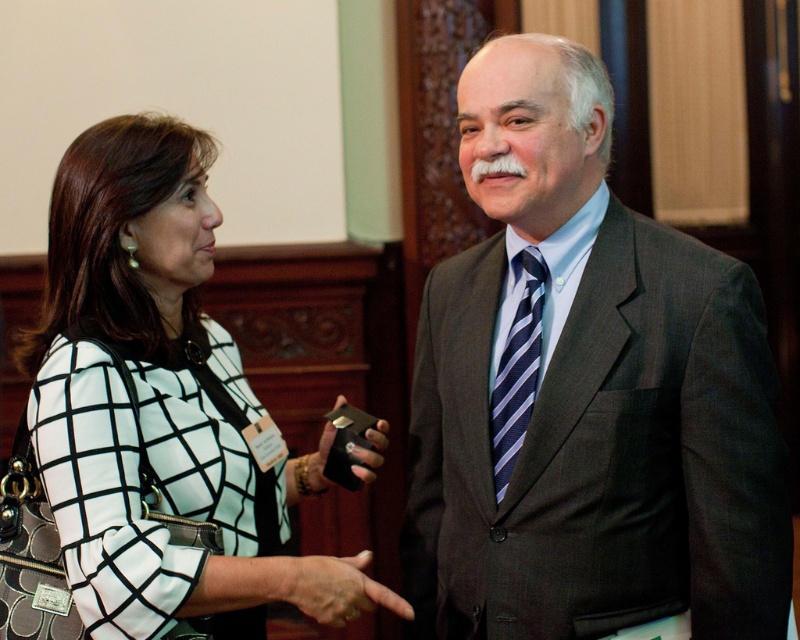
You are a photographer taking a picture of two people in the scene. You want to focus on the dark gray suit at center and the white checkered blazer at center. Which one should you adjust your camera to focus on first if you want to capture both clearly?

The dark gray suit at center is located above the white checkered blazer at center, so you should focus on the dark gray suit at center first to ensure both are in clear focus.

You are standing in a room where two people are talking. You see a dark gray suit at center and a white checkered blazer at center. Which one is positioned to the right?

The dark gray suit at center is positioned to the right of the white checkered blazer at center.

You are a fashion designer observing two people in an office setting. You notice the white checkered blazer at center and the leather textured hand at center. Which of these items is positioned higher in the image?

The white checkered blazer at center is located above the leather textured hand at center, so it is positioned higher in the image.